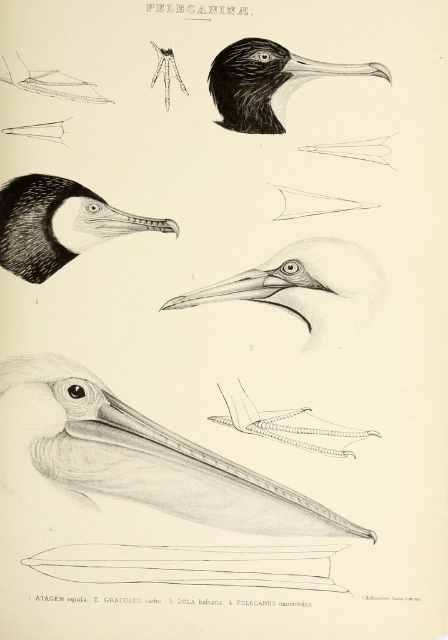
Question: Which point is farther to the camera?

Choices:
 (A) (85, 196)
 (B) (318, 74)
 (C) (304, 74)
 (D) (136, 444)

Answer: (D)

Question: Can you confirm if black matte bird head at upper left is smaller than black glossy beak at upper center?

Choices:
 (A) no
 (B) yes

Answer: (A)

Question: Can you confirm if white matte pelican beak at lower left is thinner than black matte bird head at upper left?

Choices:
 (A) no
 (B) yes

Answer: (A)

Question: Is white matte pelican beak at lower left behind black matte bird head at upper left?

Choices:
 (A) yes
 (B) no

Answer: (A)

Question: Which point is closer to the camera?

Choices:
 (A) tap(46, 212)
 (B) tap(306, 285)
 (C) tap(215, 93)
 (D) tap(203, 291)

Answer: (C)

Question: Which of these objects is positioned farthest from the white matte beak at center?

Choices:
 (A) black matte bird head at upper left
 (B) black glossy beak at upper center
 (C) matte gray beak at center

Answer: (B)